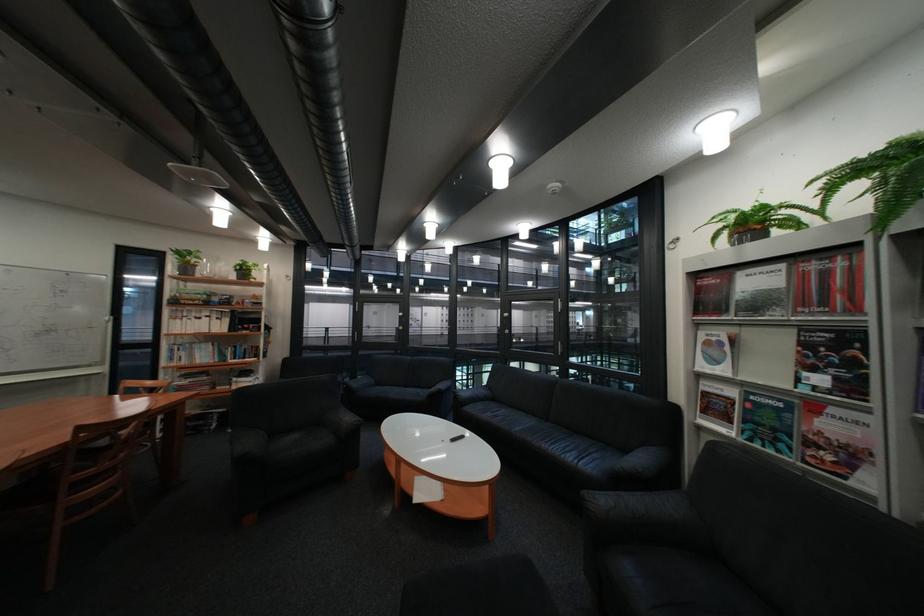
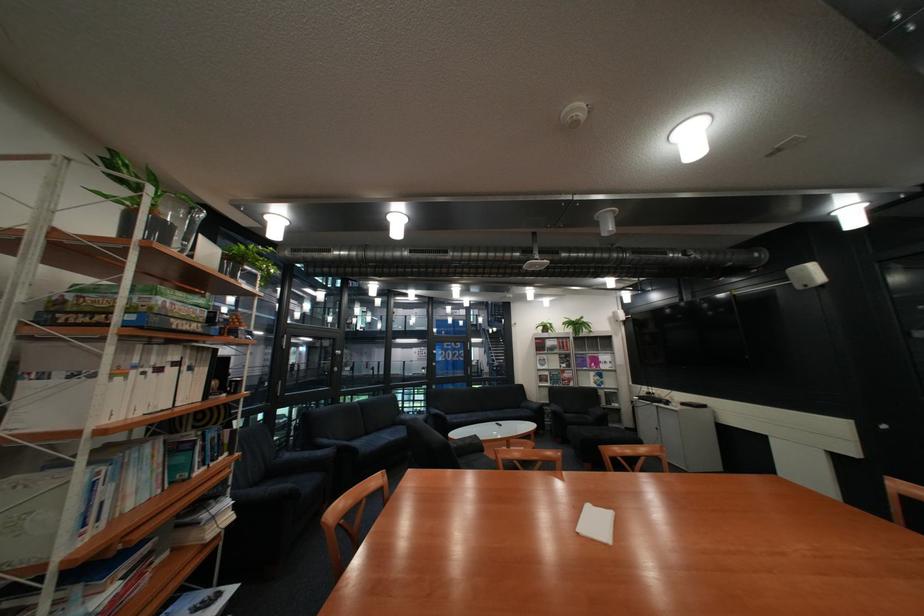
Question: I am providing you with two images of the same scene from different viewpoints. Which of the following objects are not visible in image2?

Choices:
 (A) glass window handle
 (B) dark chair armrest
 (C) white binder
 (D) none of these

Answer: (D)